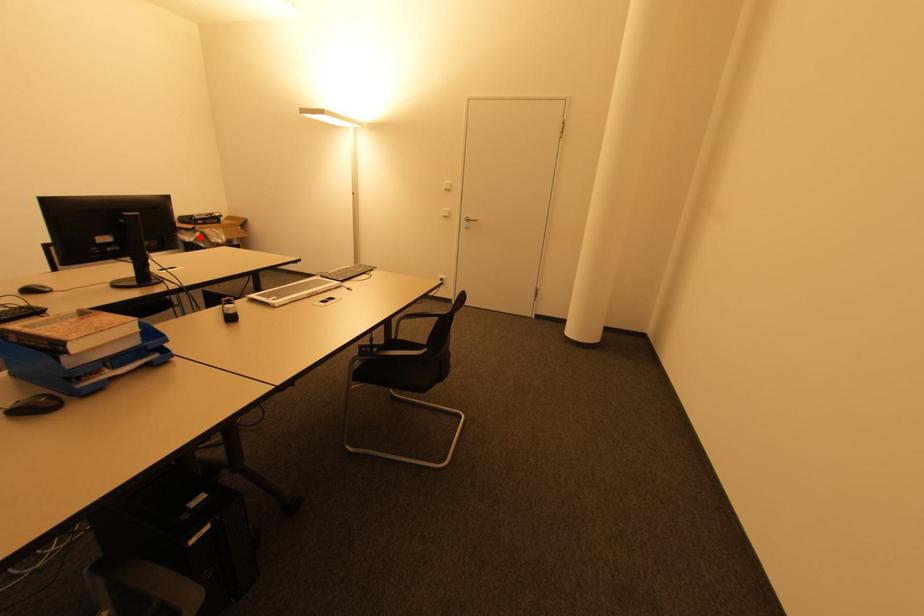
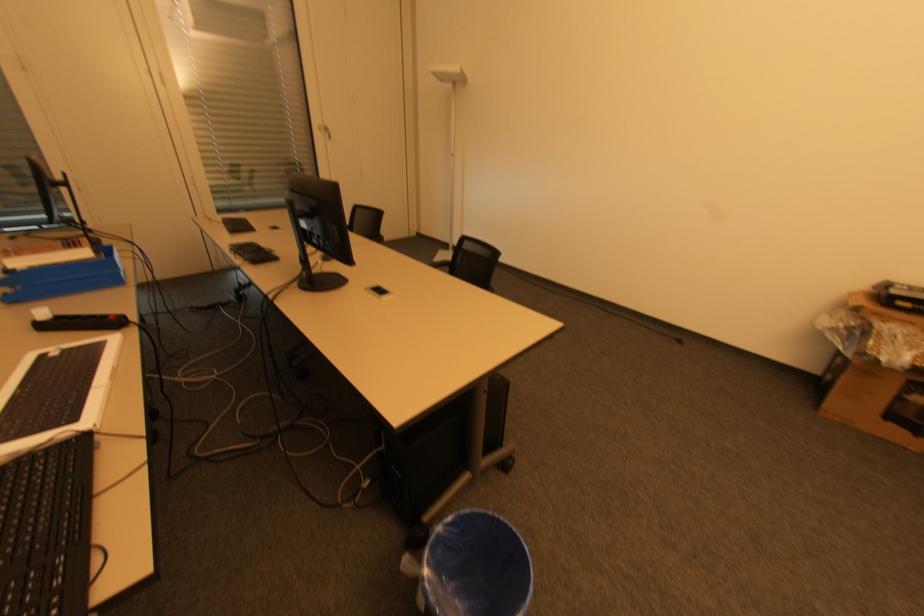
Locate, in the second image, the point that corresponds to the highlighted location in the first image.

(850, 328)